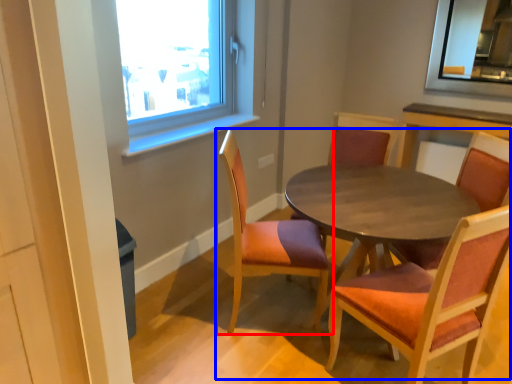
Question: Which point is closer to the camera, chair (highlighted by a red box) or kitchen & dining room table (highlighted by a blue box)?

Choices:
 (A) chair
 (B) kitchen & dining room table

Answer: (B)